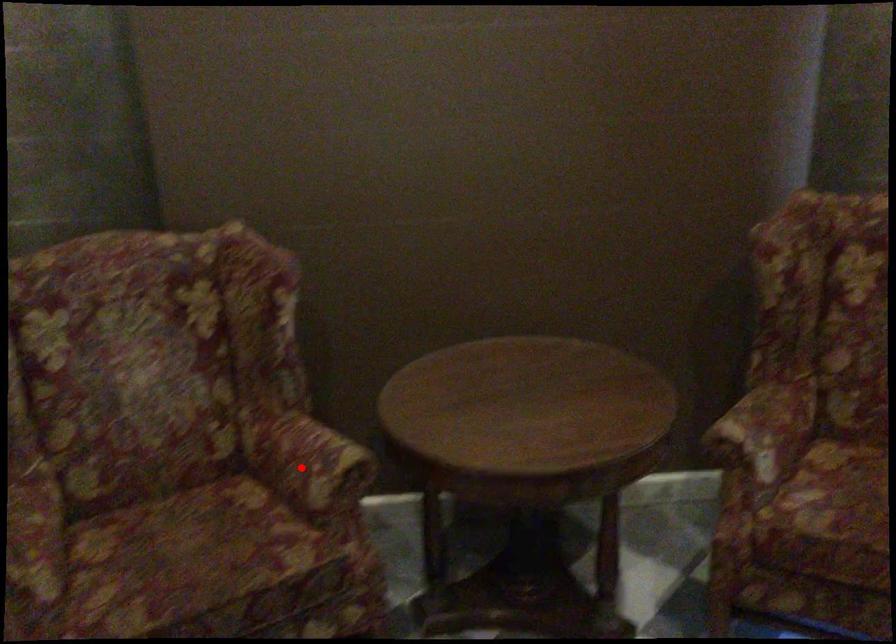
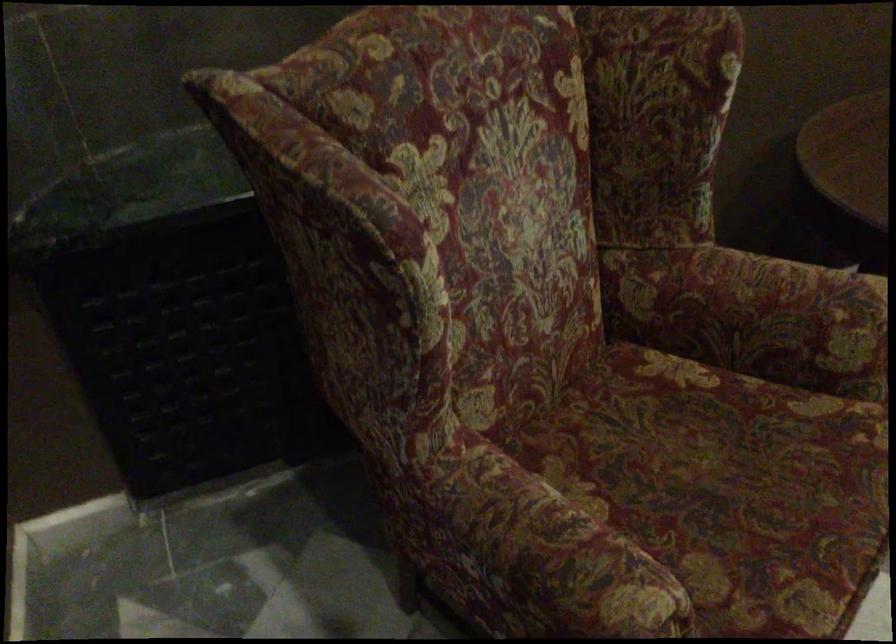
Where in the second image is the point corresponding to the highlighted location from the first image?

(786, 321)